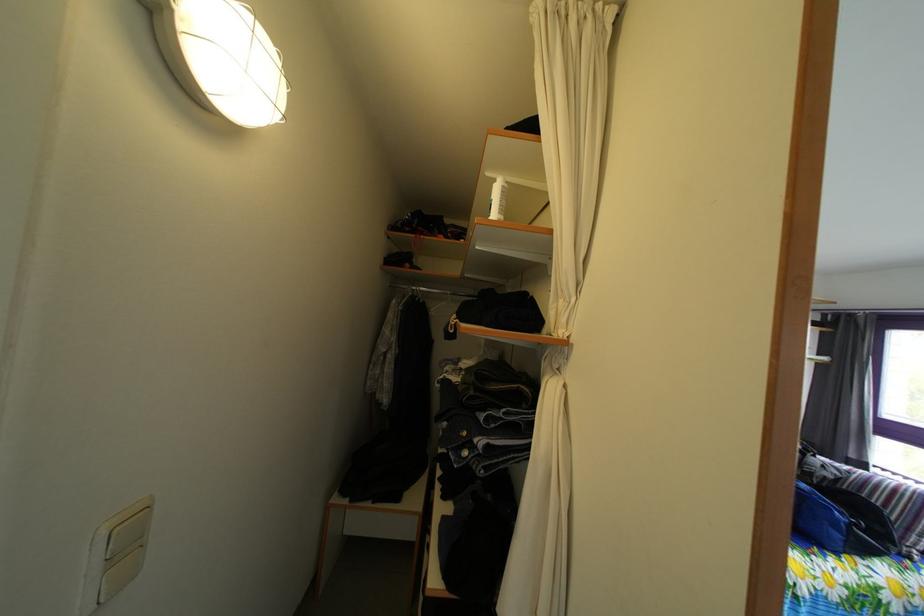
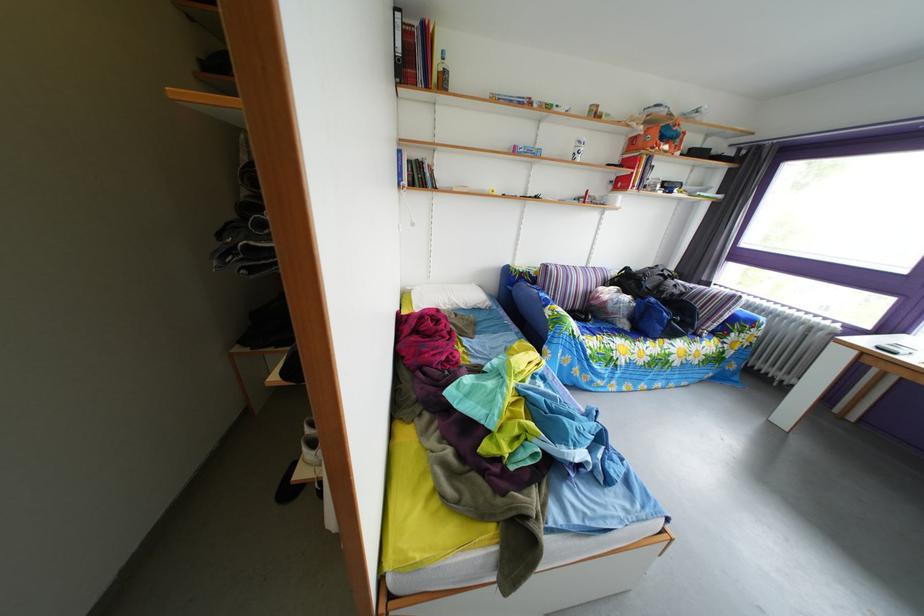
Question: The images are taken continuously from a first-person perspective. In which direction are you moving?

Choices:
 (A) Left
 (B) Right
 (C) Forward
 (D) Backward

Answer: (B)